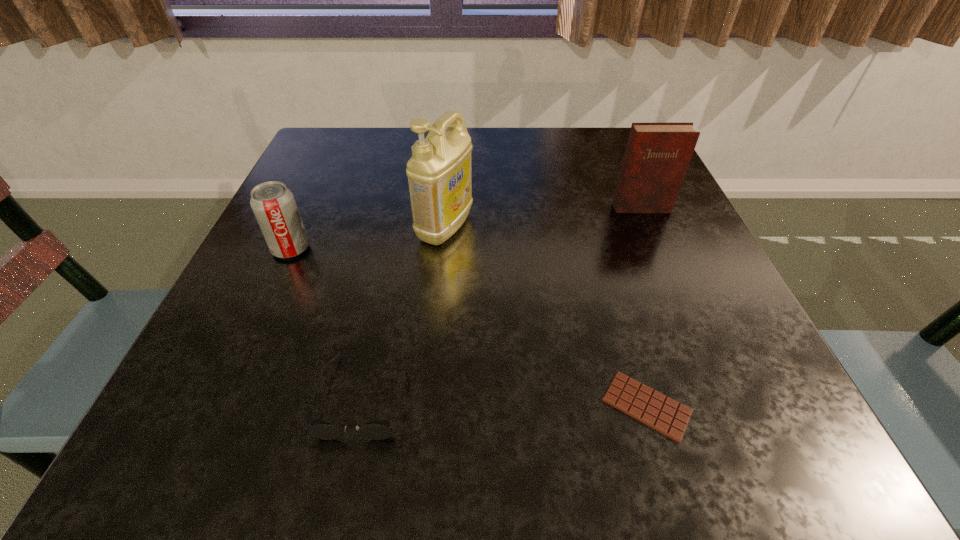
This screenshot has height=540, width=960. Find the location of `sunglasses positioned at the near edge`. sunglasses positioned at the near edge is located at coordinates (380, 429).

At what (x,y) coordinates should I click in order to perform the action: click on candy bar that is at the near edge. Please return your answer as a coordinate pair (x, y). Looking at the image, I should click on (660, 412).

At what (x,y) coordinates should I click in order to perform the action: click on object that is at the left edge. Please return your answer as a coordinate pair (x, y). Looking at the image, I should click on (273, 204).

The height and width of the screenshot is (540, 960). Find the location of `diary that is at the right edge`. diary that is at the right edge is located at coordinates (x=657, y=155).

Locate an element on the screen. candy bar that is at the right edge is located at coordinates (660, 412).

You are a GUI agent. You are given a task and a screenshot of the screen. Output one action in this format:
    pyautogui.click(x=<x>, y=<y>)
    Task: Click on the object present at the near right corner
    The height and width of the screenshot is (540, 960).
    Given the screenshot: What is the action you would take?
    pyautogui.click(x=660, y=412)

At what (x,y) coordinates should I click in order to perform the action: click on vacant space at the far edge of the desktop. Please return your answer as a coordinate pair (x, y). Looking at the image, I should click on (388, 141).

This screenshot has width=960, height=540. I want to click on vacant point at the near edge, so coord(603,423).

The image size is (960, 540). Identify the location of vacant region at the left edge of the desktop. (292, 342).

The width and height of the screenshot is (960, 540). I want to click on vacant space at the right edge of the desktop, so click(x=686, y=245).